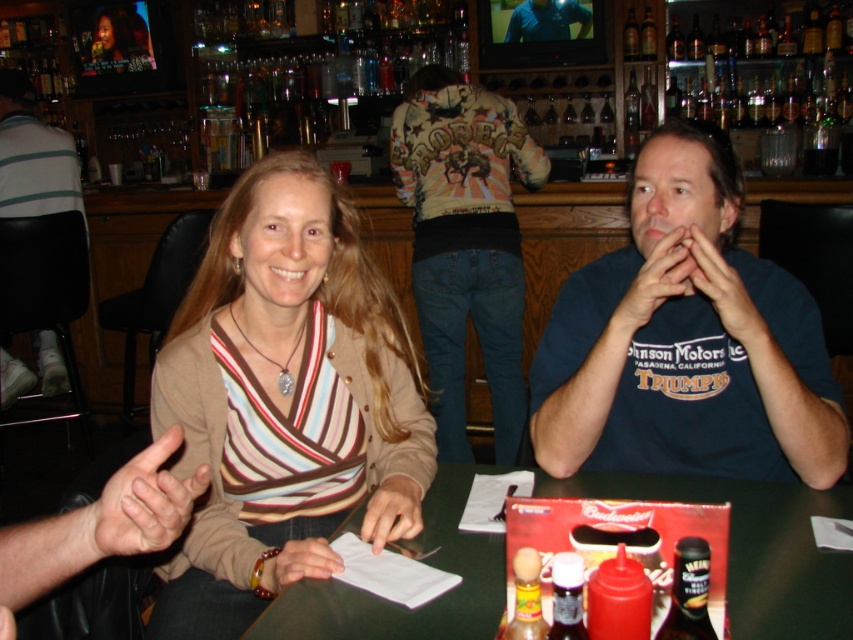
Question: Which point is closer to the camera taking this photo?

Choices:
 (A) (796, 483)
 (B) (271, 584)

Answer: (B)

Question: Is green matte table at center wider than smooth skin hand at lower left?

Choices:
 (A) no
 (B) yes

Answer: (B)

Question: Among these objects, which one is nearest to the camera?

Choices:
 (A) green matte table at center
 (B) dark blue t-shirt at center
 (C) smooth leather wallet at lower center

Answer: (A)

Question: Which object is positioned closest to the green matte table at center?

Choices:
 (A) smooth skin hand at lower left
 (B) matte blue shirt at right
 (C) blue cotton shirt at center

Answer: (B)

Question: Observing the image, what is the correct spatial positioning of dark blue t-shirt at center in reference to smooth skin hand at lower left?

Choices:
 (A) right
 (B) left

Answer: (A)

Question: In this image, where is striped knit sweater at center located relative to matte blue shirt at right?

Choices:
 (A) right
 (B) left

Answer: (B)